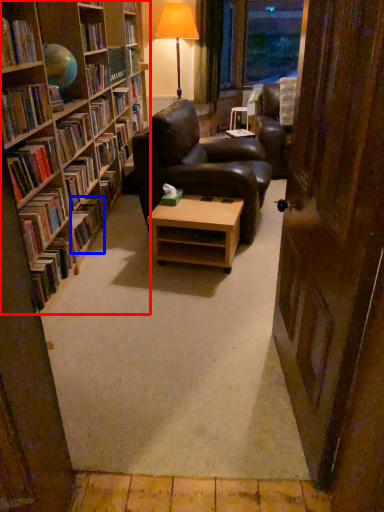
Question: Which point is further to the camera, bookcase (highlighted by a red box) or book (highlighted by a blue box)?

Choices:
 (A) bookcase
 (B) book

Answer: (B)